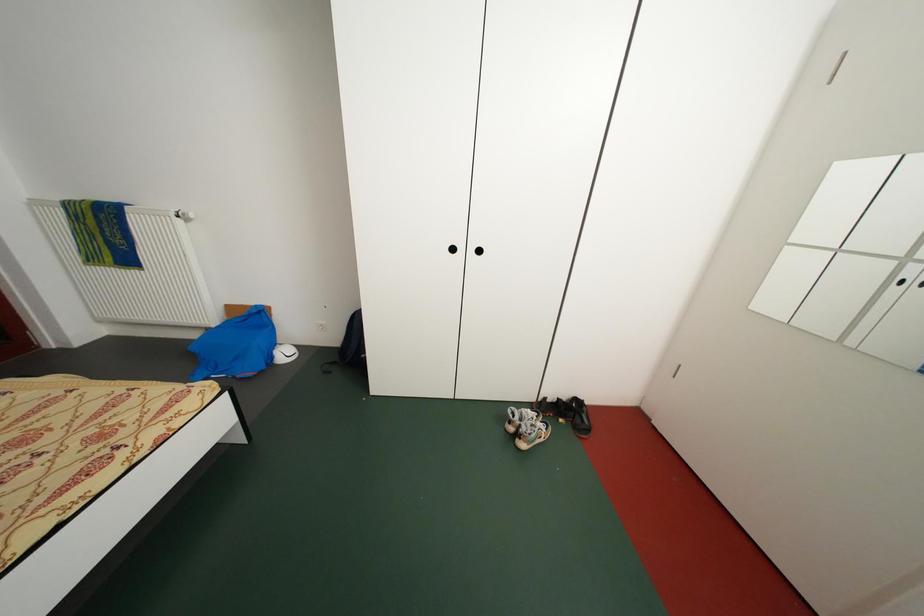
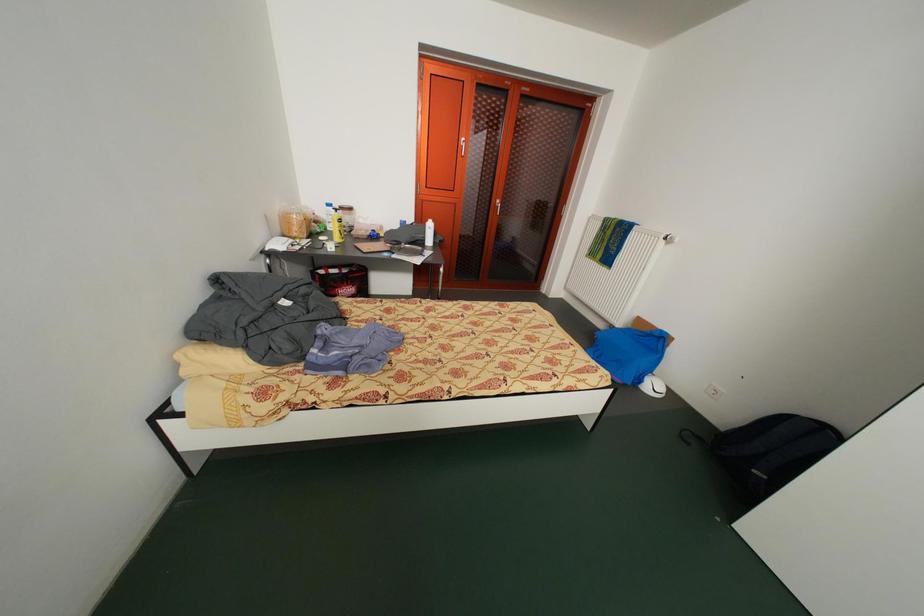
The first image is from the beginning of the video and the second image is from the end. How did the camera likely rotate when shooting the video?

The camera's rotation is toward left-down.